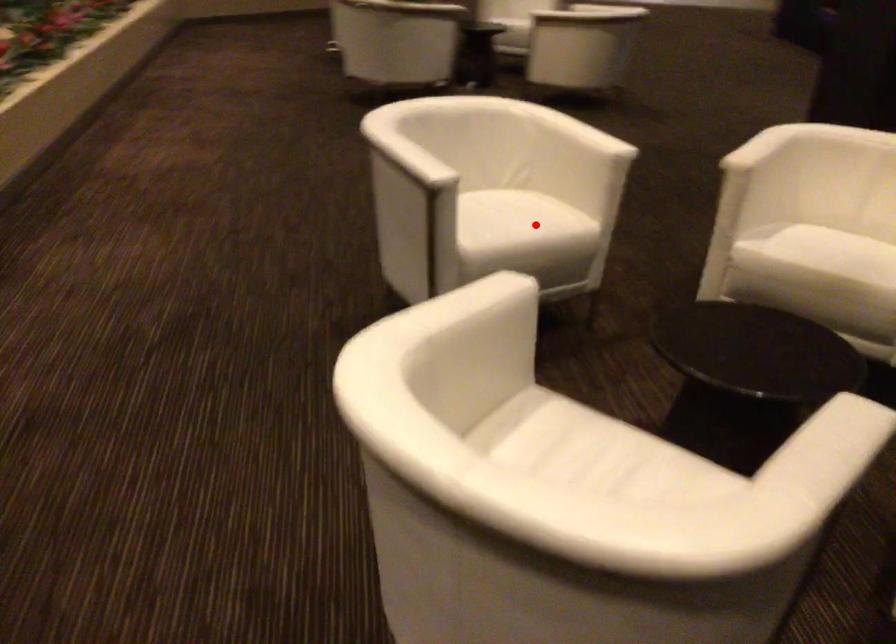
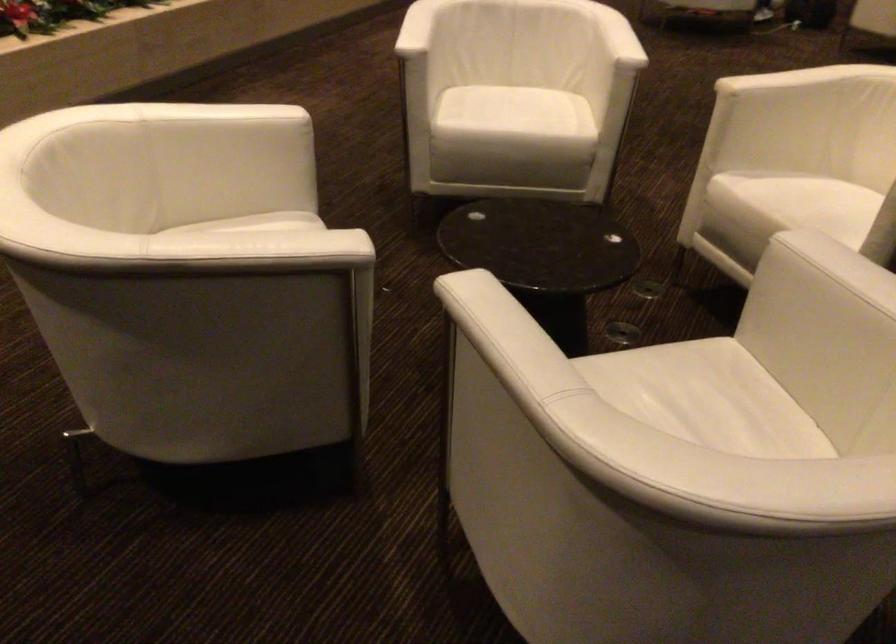
Find the pixel in the second image that matches the highlighted location in the first image.

(524, 117)